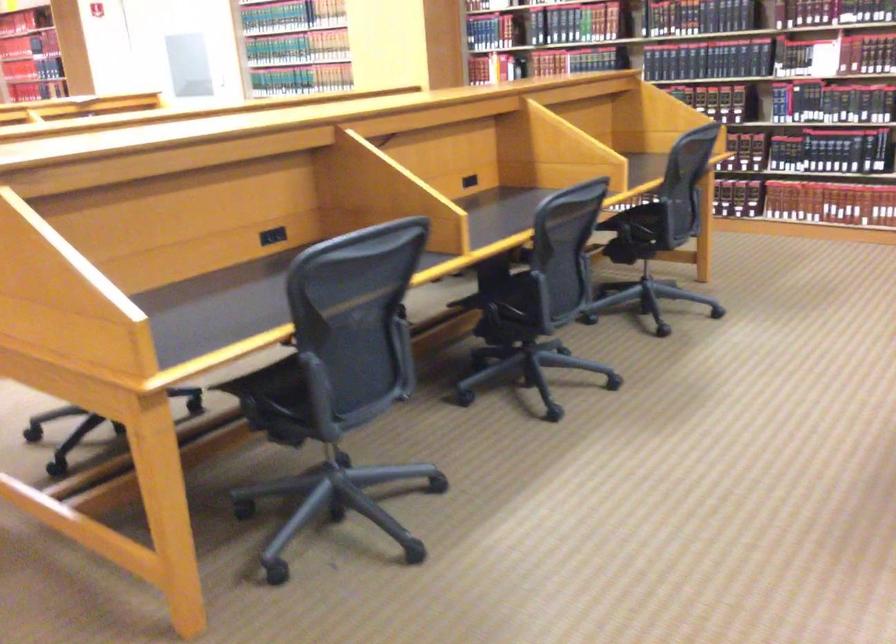
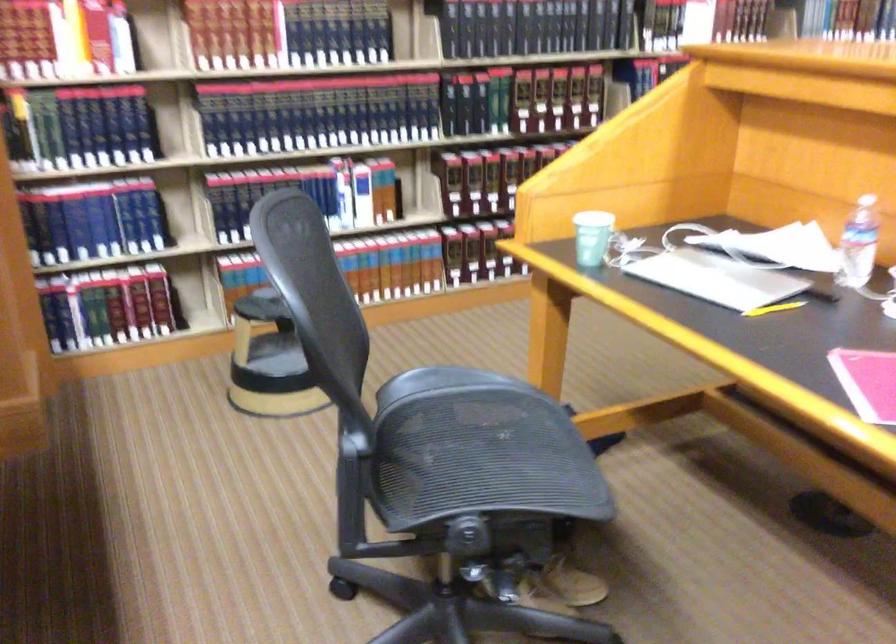
Question: I am providing you with two images of the same scene from different viewpoints. Please identify which objects are invisible in image2.

Choices:
 (A) yellow pencil
 (B) framed whiteboard
 (C) plastic water bottle
 (D) hardcover book

Answer: (D)